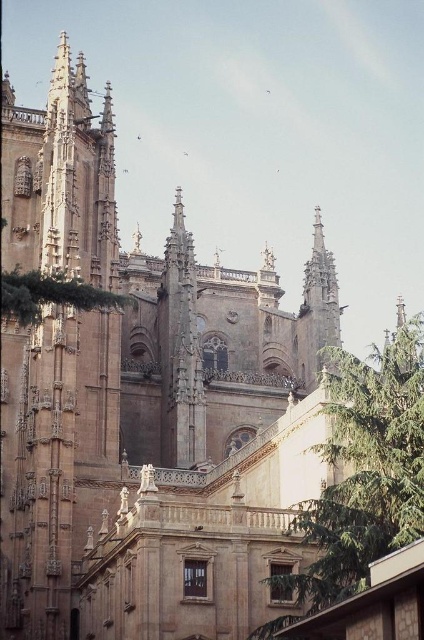
You are a landscape architect designing a pathway between the two green leafy trees. The pathway must be exactly 12 meters long. Is the distance between the green leafy tree at center and the green leafy tree at upper left sufficient for this requirement?

The green leafy tree at center and green leafy tree at upper left are 13.11 meters apart from each other. Since the required pathway is 12 meters, the distance is sufficient as it is longer than needed.